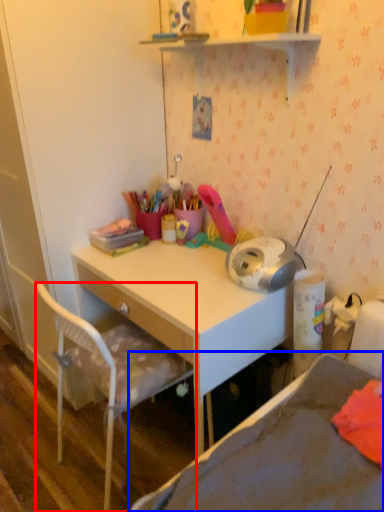
Question: Which object appears farthest to the camera in this image, chair (highlighted by a red box) or bed (highlighted by a blue box)?

Choices:
 (A) chair
 (B) bed

Answer: (A)